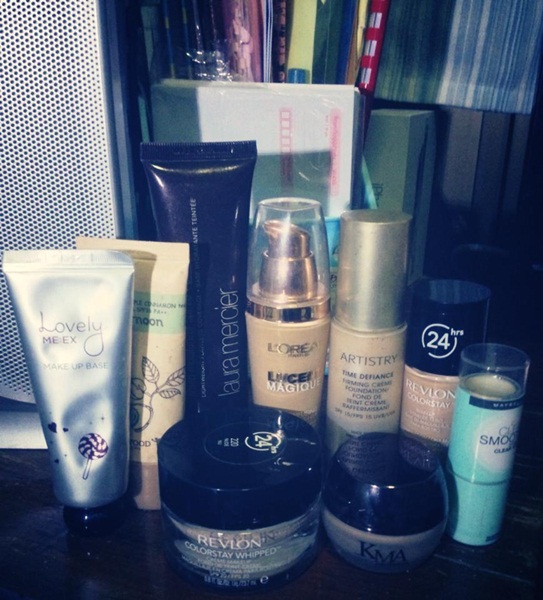
Locate an element on the screen. Image resolution: width=543 pixels, height=600 pixels. makeup is located at coordinates (427, 397).